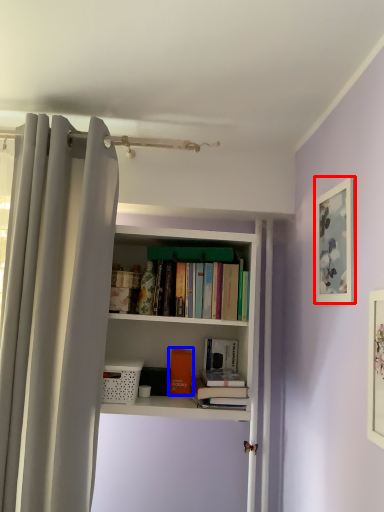
Question: Among these objects, which one is nearest to the camera, picture frame (highlighted by a red box) or book (highlighted by a blue box)?

Choices:
 (A) picture frame
 (B) book

Answer: (A)